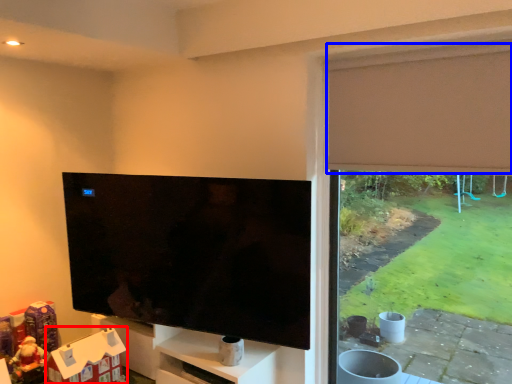
Question: Which point is closer to the camera, toy (highlighted by a red box) or curtain (highlighted by a blue box)?

Choices:
 (A) toy
 (B) curtain

Answer: (B)